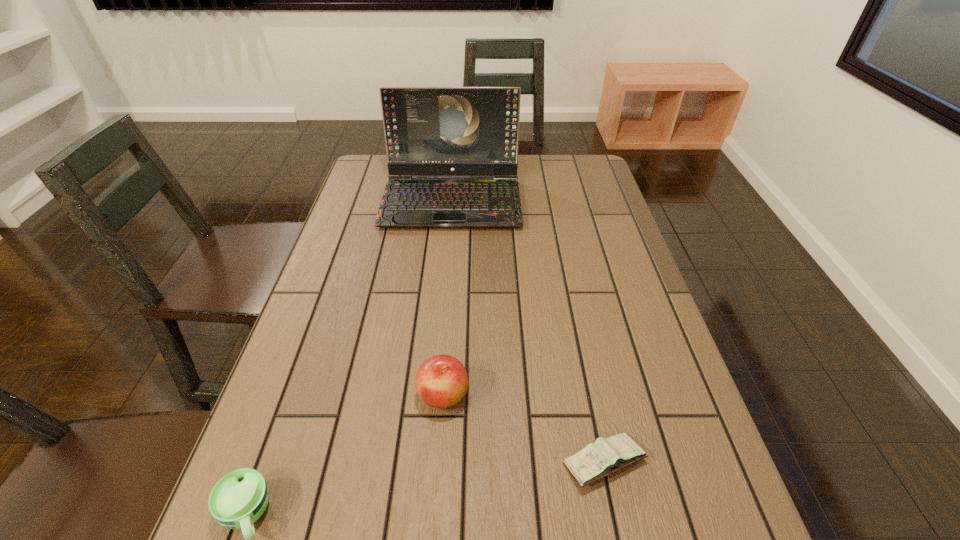
Find the location of a particular element. object at the left edge is located at coordinates (429, 131).

Where is `object situated at the right edge`? object situated at the right edge is located at coordinates (597, 460).

Where is `object positioned at the far left corner`? The image size is (960, 540). object positioned at the far left corner is located at coordinates (429, 131).

In the image, there is a desktop. Where is `vacant space at the far edge`? The height and width of the screenshot is (540, 960). vacant space at the far edge is located at coordinates (522, 171).

The width and height of the screenshot is (960, 540). I want to click on free space at the left edge, so click(x=319, y=294).

I want to click on vacant space at the right edge of the desktop, so click(x=578, y=240).

What are the coordinates of `free space at the far right corner of the desktop` in the screenshot? It's located at (557, 160).

This screenshot has width=960, height=540. Find the location of `free space between the second tallest object and the farthest object`. free space between the second tallest object and the farthest object is located at coordinates (447, 298).

The width and height of the screenshot is (960, 540). I want to click on free space that is in between the farthest object and the second tallest object, so click(447, 298).

Where is `vacant area that lies between the second farthest object and the farthest object`? The height and width of the screenshot is (540, 960). vacant area that lies between the second farthest object and the farthest object is located at coordinates click(x=447, y=298).